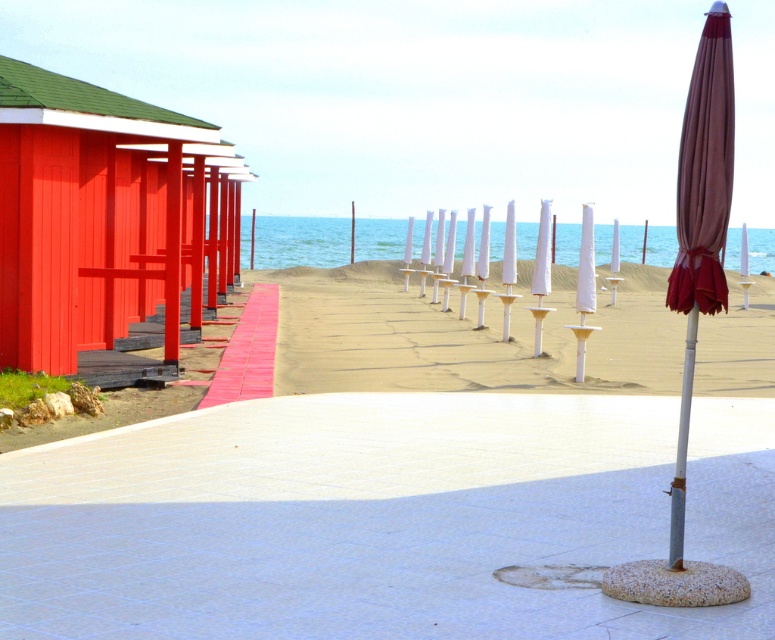
Between brown fabric umbrella at center right and blue water at center, which one appears on the right side from the viewer's perspective?

Positioned to the right is brown fabric umbrella at center right.

From the picture: Can you confirm if brown fabric umbrella at center right is shorter than blue water at center?

Correct, brown fabric umbrella at center right is not as tall as blue water at center.

Identify the location of brown fabric umbrella at center right. The image size is (775, 640). (701, 220).

Image resolution: width=775 pixels, height=640 pixels. Find the location of `brown fabric umbrella at center right`. brown fabric umbrella at center right is located at coordinates (701, 220).

Which is in front, point (763, 561) or point (52, 358)?

Point (763, 561) is in front.

Which is more to the left, white concrete path at center or matte red wooden beach hut at left?

From the viewer's perspective, matte red wooden beach hut at left appears more on the left side.

I want to click on white concrete path at center, so click(x=381, y=516).

Who is more distant from viewer, (674, 486) or (694, 330)?

The point (674, 486) is more distant.

Does brown fabric umbrella at center right appear under white metallic pole at right?

Actually, brown fabric umbrella at center right is above white metallic pole at right.

This screenshot has width=775, height=640. Describe the element at coordinates (701, 220) in the screenshot. I see `brown fabric umbrella at center right` at that location.

Image resolution: width=775 pixels, height=640 pixels. In order to click on brown fabric umbrella at center right in this screenshot , I will do `click(701, 220)`.